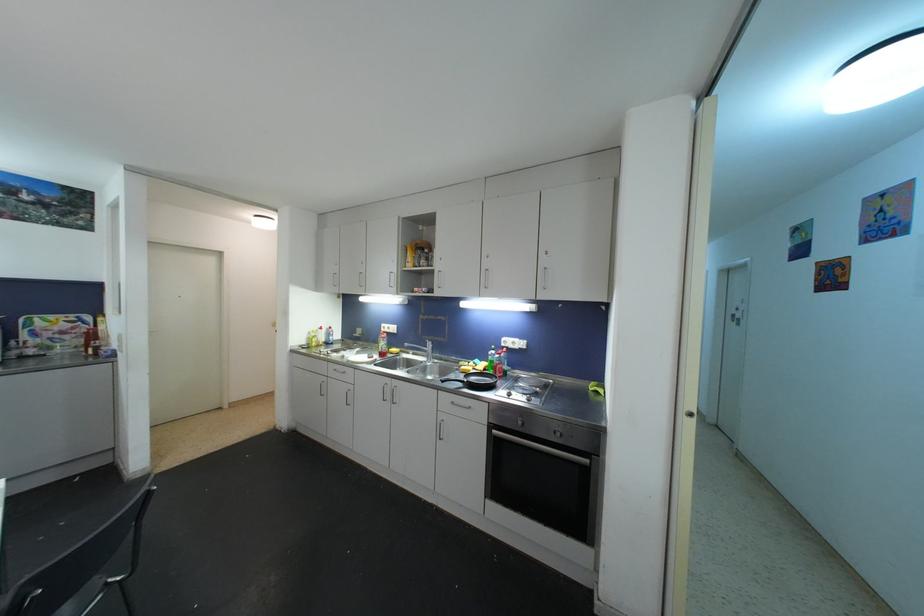
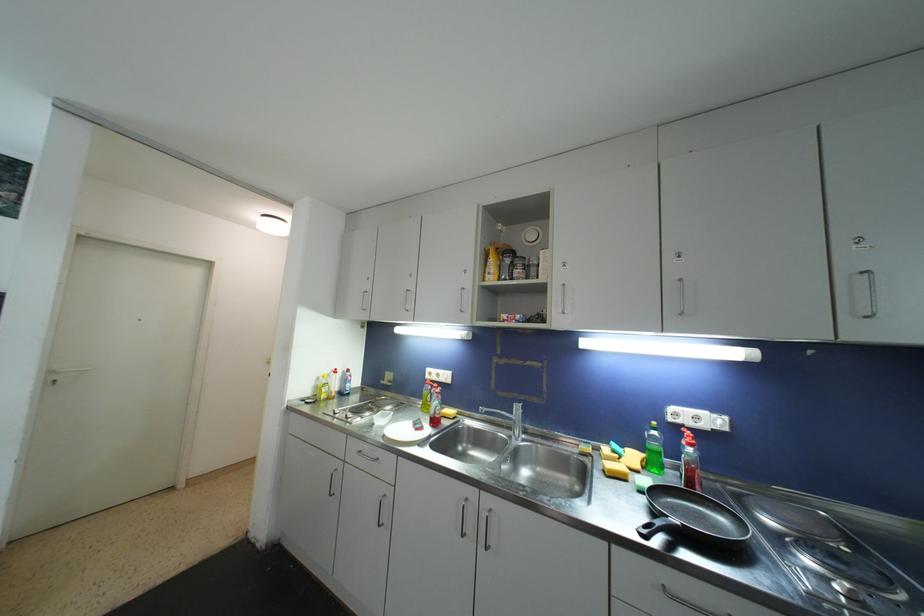
Locate, in the second image, the point that corresponds to point (312, 342) in the first image.

(321, 391)